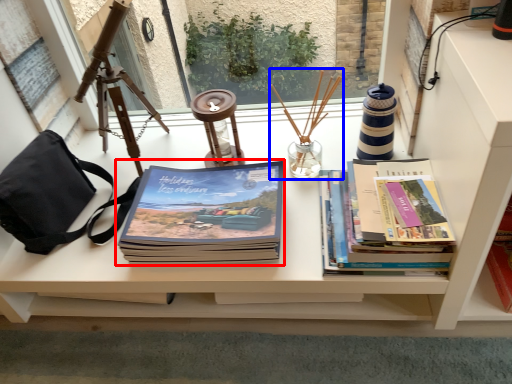
Question: Among these objects, which one is farthest to the camera, book (highlighted by a red box) or candle holder (highlighted by a blue box)?

Choices:
 (A) book
 (B) candle holder

Answer: (B)